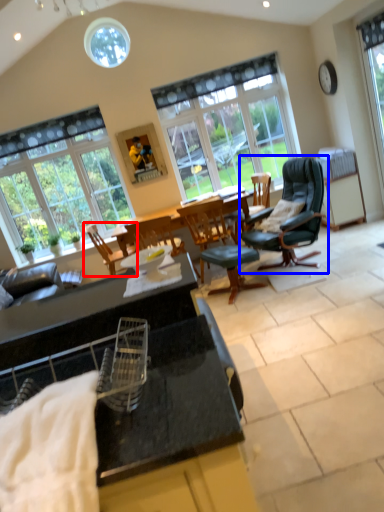
Question: Which of the following is the closest to the observer, chair (highlighted by a red box) or chair (highlighted by a blue box)?

Choices:
 (A) chair
 (B) chair

Answer: (B)